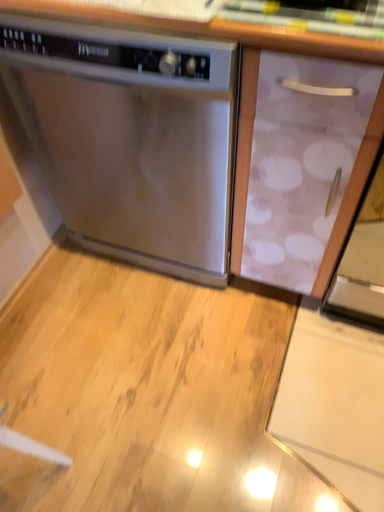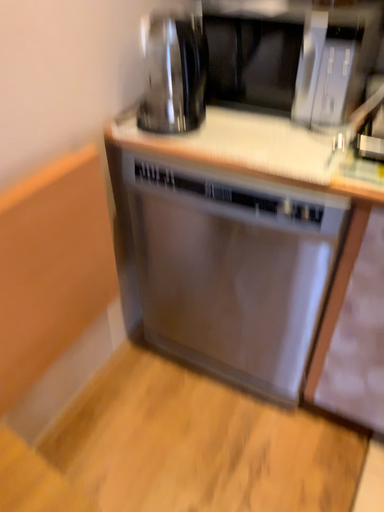
Question: How did the camera likely rotate when shooting the video?

Choices:
 (A) rotated upward
 (B) rotated downward

Answer: (A)